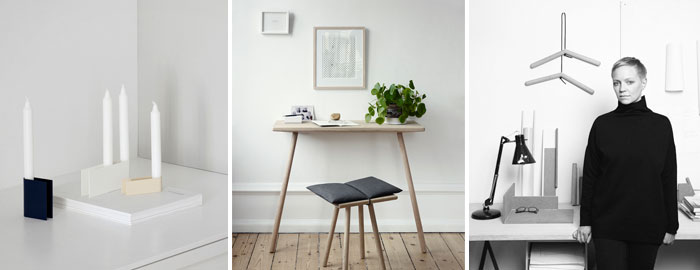
You are a GUI agent. You are given a task and a screenshot of the screen. Output one action in this format:
    pyautogui.click(x=<x>, y=<y>)
    Task: Click on the desk
    The height and width of the screenshot is (270, 700).
    Given the screenshot: What is the action you would take?
    pyautogui.click(x=349, y=136), pyautogui.click(x=686, y=233)